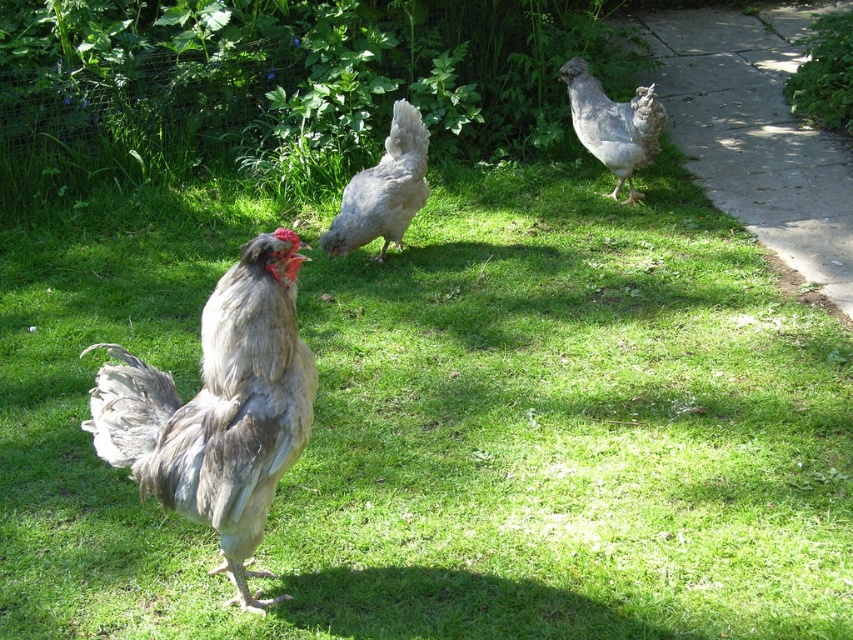
You are a farmer who needs to identify the tallest chicken in the scene. Based on the image, which chicken is taller between the gray feathered rooster at center and the gray matte chicken at center?

The gray feathered rooster at center is taller than the gray matte chicken at center.

You are standing at the origin point in the image. There are two points marked as point 1 at coordinates (x=662, y=58) and point 2 at coordinates (x=418, y=150). Which point is closer to you?

Point 2 at coordinates (x=418, y=150) is closer to you because it is in front of point 1 at coordinates (x=662, y=58).